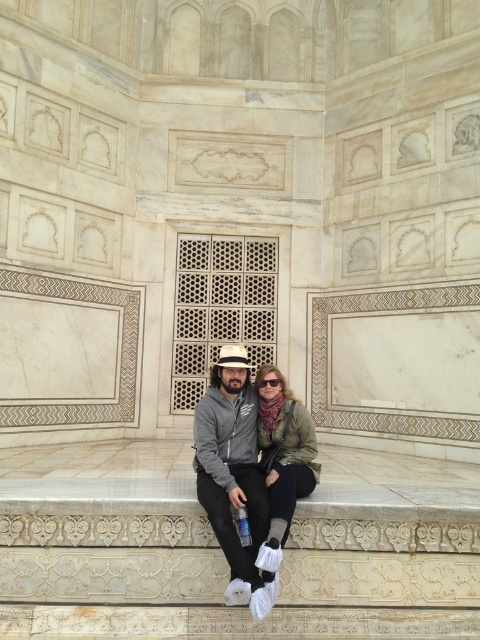
Question: Is the position of matte gray hoodie at center more distant than that of green textured jacket at center?

Choices:
 (A) yes
 (B) no

Answer: (B)

Question: Can you confirm if matte gray hoodie at center is positioned to the left of green textured jacket at center?

Choices:
 (A) yes
 (B) no

Answer: (A)

Question: Does matte gray hoodie at center have a larger size compared to green textured jacket at center?

Choices:
 (A) no
 (B) yes

Answer: (B)

Question: Which point appears closest to the camera in this image?

Choices:
 (A) (314, 436)
 (B) (251, 609)

Answer: (B)

Question: Which object appears farthest from the camera in this image?

Choices:
 (A) matte gray hoodie at center
 (B) green textured jacket at center

Answer: (B)